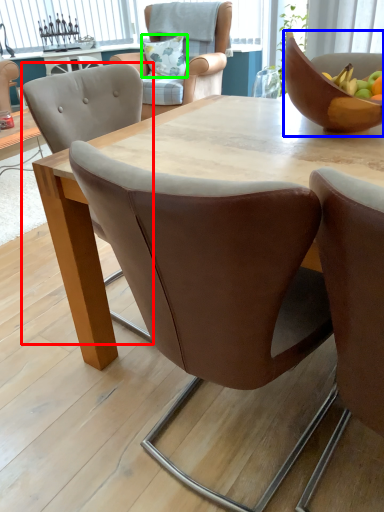
Question: Which is nearer to the chair (highlighted by a red box)? bowl (highlighted by a blue box) or pillow (highlighted by a green box).

Choices:
 (A) bowl
 (B) pillow

Answer: (A)